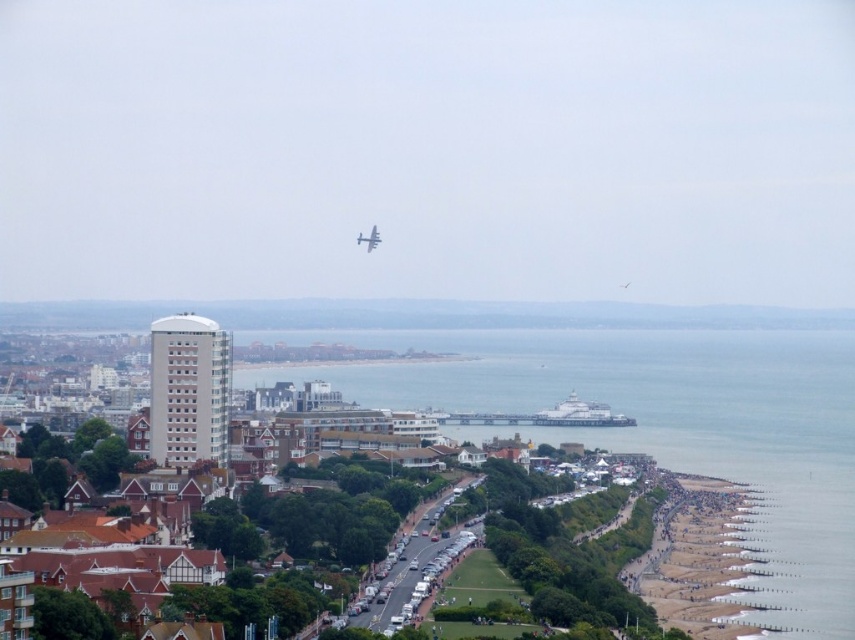
Is clear blue water at beach right to the left of metallic silver airplane at center from the viewer's perspective?

No, clear blue water at beach right is not to the left of metallic silver airplane at center.

Does clear blue water at beach right appear over metallic silver airplane at center?

Incorrect, clear blue water at beach right is not positioned above metallic silver airplane at center.

Does point (652, 445) come behind point (370, 236)?

Yes, it is.

Where is `clear blue water at beach right`? Image resolution: width=855 pixels, height=640 pixels. clear blue water at beach right is located at coordinates (664, 428).